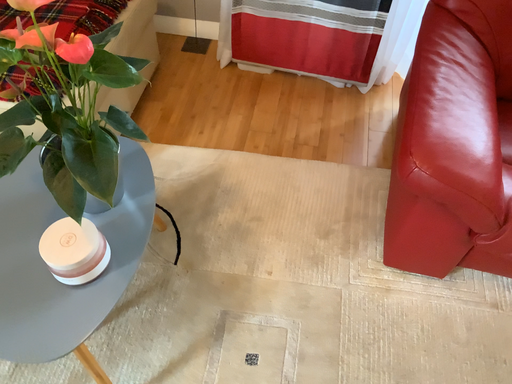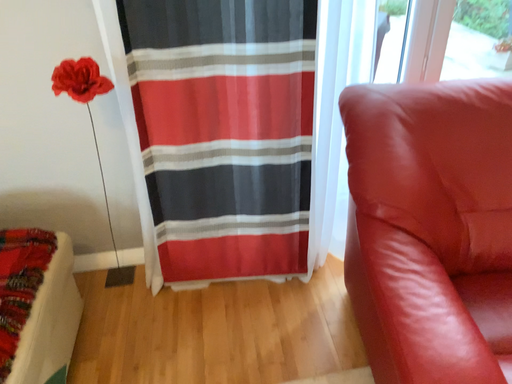
Question: How did the camera likely rotate when shooting the video?

Choices:
 (A) rotated downward
 (B) rotated upward

Answer: (B)